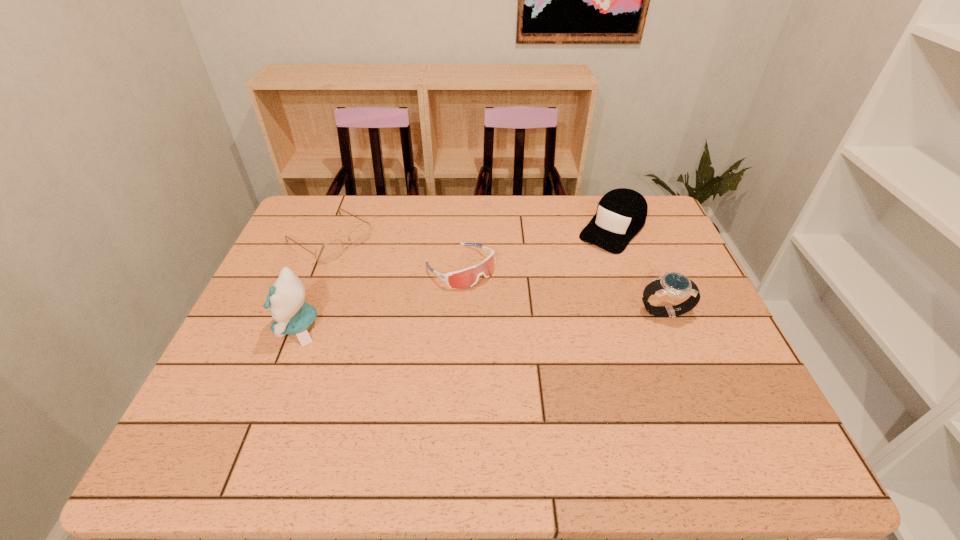
At what (x,y) coordinates should I click in order to perform the action: click on vacant space located on the front-facing side of the fourth tallest object. Please return your answer as a coordinate pair (x, y). The width and height of the screenshot is (960, 540). Looking at the image, I should click on (589, 382).

This screenshot has height=540, width=960. Identify the location of vacant space situated on the front-facing side of the fourth tallest object. (537, 335).

Where is `free point located 0.180m on the front-facing side of the fourth tallest object`? free point located 0.180m on the front-facing side of the fourth tallest object is located at coordinates (526, 325).

Find the location of a particular element. The height and width of the screenshot is (540, 960). blank space located 0.120m on the front-facing side of the shortest object is located at coordinates [382, 274].

Find the location of a particular element. This screenshot has height=540, width=960. vacant space located 0.330m on the front-facing side of the shortest object is located at coordinates (435, 309).

The height and width of the screenshot is (540, 960). What are the coordinates of `free space located 0.390m on the front-facing side of the shortest object` in the screenshot? It's located at (451, 321).

Locate an element on the screen. The image size is (960, 540). cap that is at the far edge is located at coordinates (621, 213).

At what (x,y) coordinates should I click in order to perform the action: click on spectacles located in the far edge section of the desktop. Please return your answer as a coordinate pair (x, y). This screenshot has width=960, height=540. Looking at the image, I should click on (327, 252).

Where is `kitten that is at the left edge`? This screenshot has width=960, height=540. kitten that is at the left edge is located at coordinates (286, 300).

This screenshot has width=960, height=540. What are the coordinates of `spectacles that is at the left edge` in the screenshot? It's located at (327, 252).